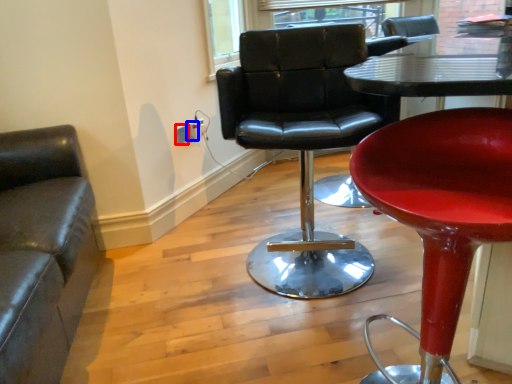
Question: Which object appears closest to the camera in this image, electric outlet (highlighted by a red box) or electric outlet (highlighted by a blue box)?

Choices:
 (A) electric outlet
 (B) electric outlet

Answer: (A)